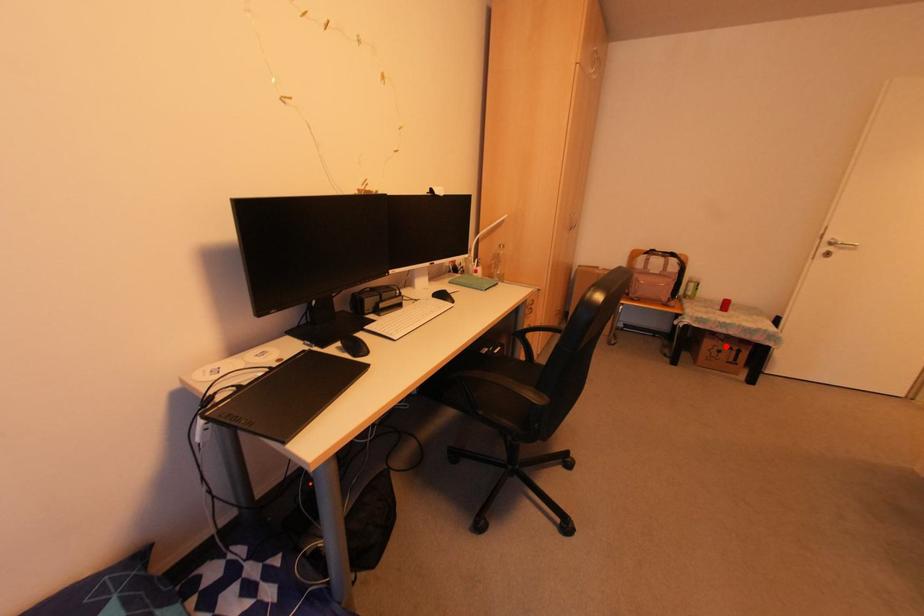
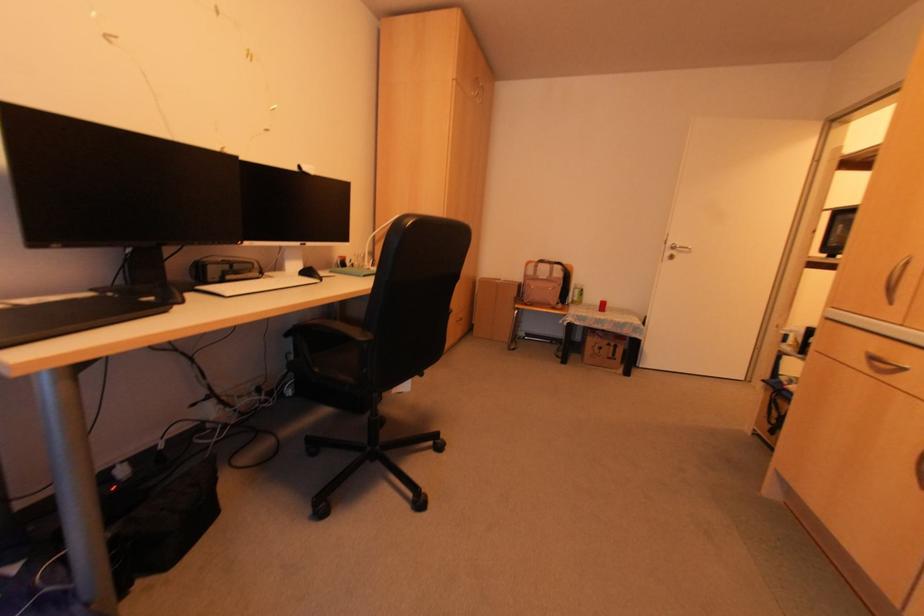
Question: I am providing you with two images of the same scene from different viewpoints. In image1, a red point is highlighted. Considering the same 3D point in image2, which of the following is correct?

Choices:
 (A) It is closer
 (B) It is farther

Answer: (A)